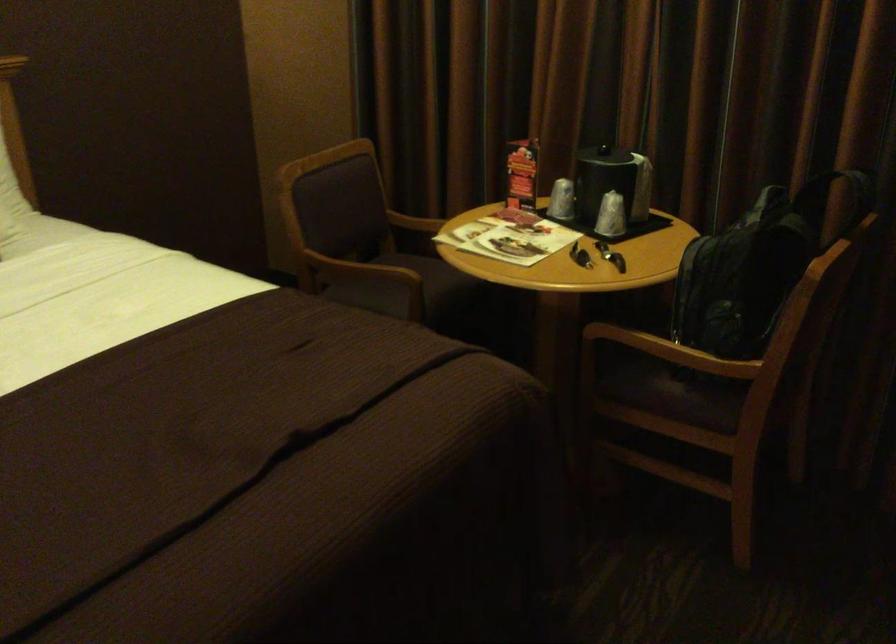
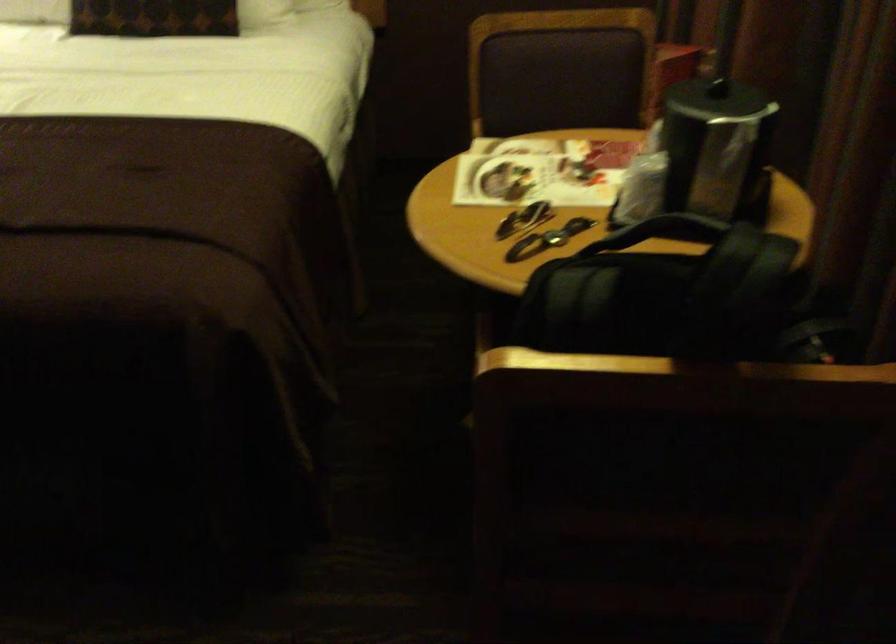
Where in the second image is the point corresponding to pixel 769 204 from the first image?

(670, 229)